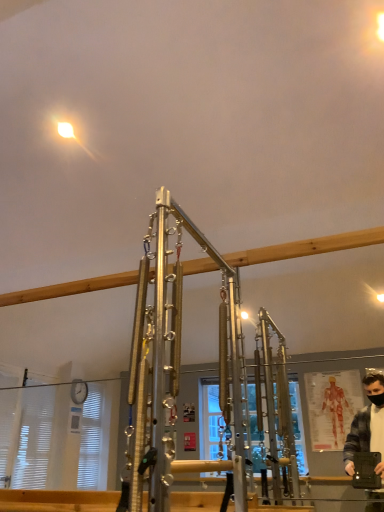
What do you see at coordinates (58, 500) in the screenshot?
I see `smooth wooden bar at center` at bounding box center [58, 500].

This screenshot has width=384, height=512. Identify the location of smooth wooden bar at center. (58, 500).

Locate an element on the screen. The image size is (384, 512). smooth wooden bar at center is located at coordinates (58, 500).